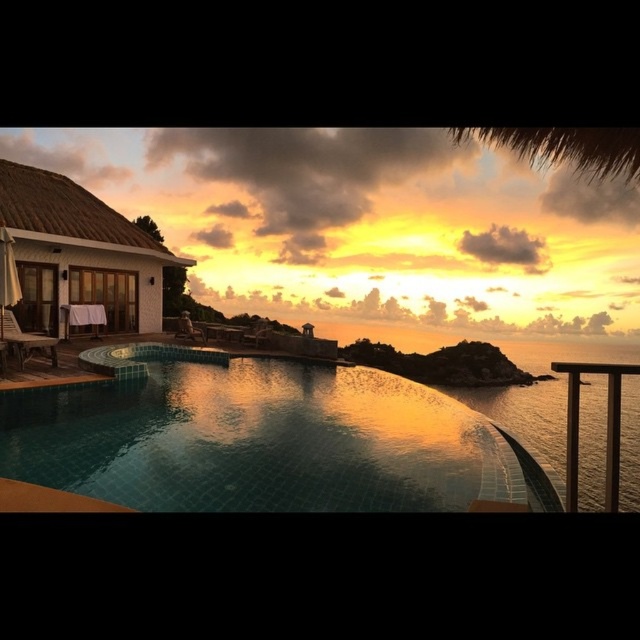
You are a guest staying at the villa and want to relax by the pool. You see the tile mosaic pool at center and the white textured hut at left. Which one is closer to the ocean?

The tile mosaic pool at center is positioned on the right side of white textured hut at left, so the pool is closer to the ocean than the hut.

You are standing at the point marked by point (77, 256), which is the white textured hut at left. You want to walk towards the infinity pool in the center. Is there any obstacle between you and the infinity pool?

The white textured hut at left is represented by point (77, 256). Since the infinity pool is in the center and the villa is at the left, there are no obstacles blocking the path between the white textured hut at left and the infinity pool in the center.

You are a guest at the villa and want to place a 1.2 meter tall sculpture between the tile mosaic pool at center and the matte wood chair at lower left. Can the sculpture fit vertically between them?

The tile mosaic pool at center is taller than the matte wood chair at lower left. Since the sculpture is 1.2 meters tall, it may not fit vertically between them if the space between the two objects is less than 1.2 meters. However, the description only mentions their relative heights, not the distance between them. Therefore, we cannot determine if the sculpture will fit based on the given information.